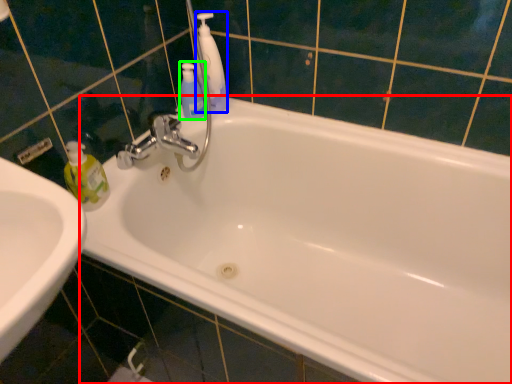
Question: Which object is positioned farthest from bathtub (highlighted by a red box)? Select from cleaning product (highlighted by a blue box) and mouthwash (highlighted by a green box).

Choices:
 (A) cleaning product
 (B) mouthwash

Answer: (B)